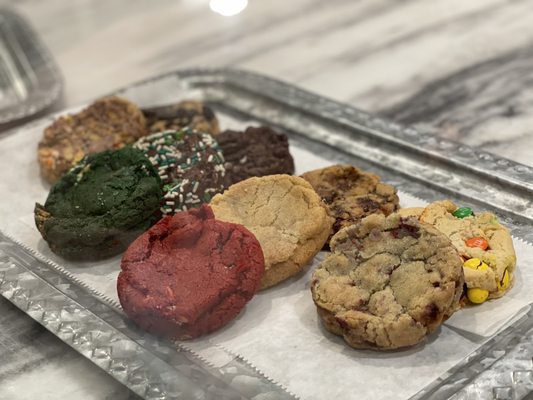
At what (x,y) coordinates should I click in order to perform the action: click on cookies lying flat on the platter. Please return your answer as a coordinate pair (x, y). Image resolution: width=533 pixels, height=400 pixels. Looking at the image, I should click on (190, 115), (245, 143), (338, 185), (482, 238).